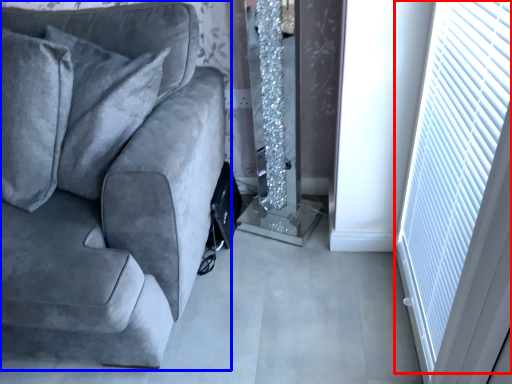
Question: Which point is further to the camera, blind (highlighted by a red box) or studio couch (highlighted by a blue box)?

Choices:
 (A) blind
 (B) studio couch

Answer: (B)